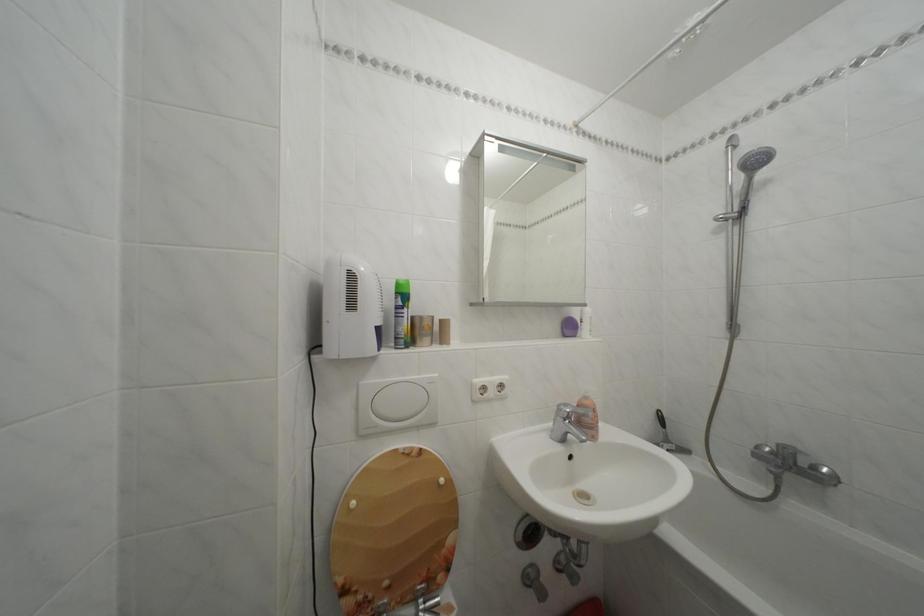
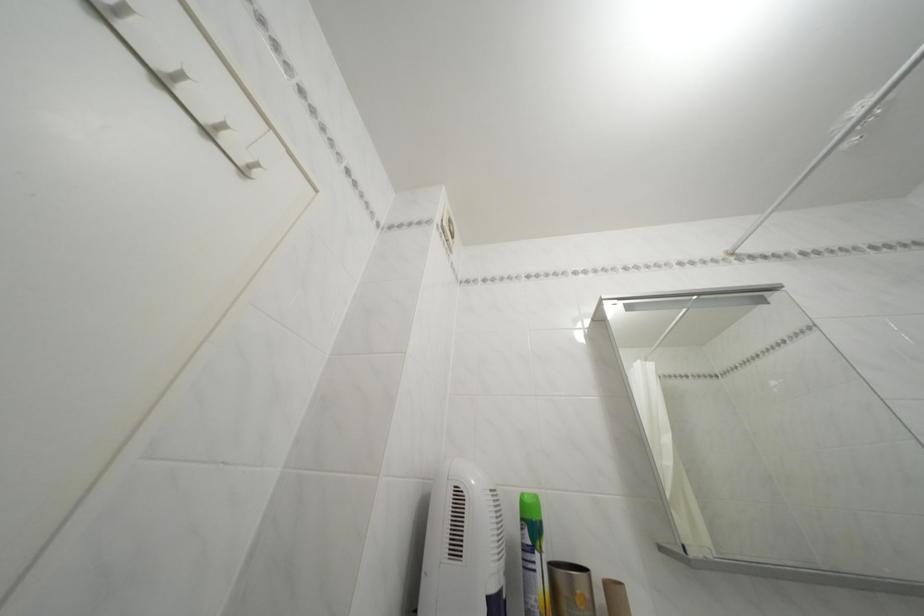
Find the pixel in the second image that matches the point at 450,326 in the first image.

(614, 591)